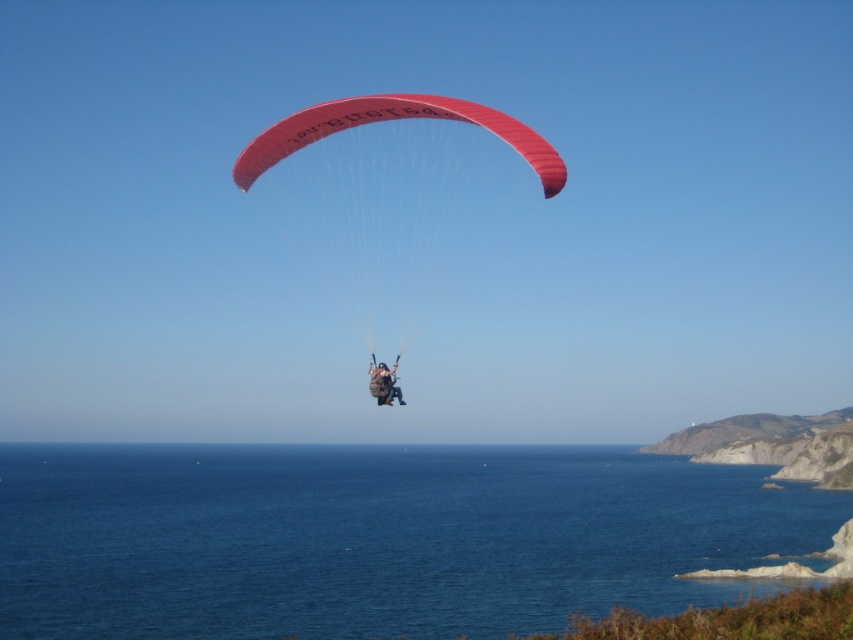
Can you confirm if blue liquid water at center is positioned below matte red parachute at center?

Indeed, blue liquid water at center is positioned under matte red parachute at center.

Which is behind, point (331, 552) or point (407, 141)?

Positioned behind is point (407, 141).

Is point (666, 524) positioned in front of point (343, 260)?

Yes.

This screenshot has width=853, height=640. What are the coordinates of `blue liquid water at center` in the screenshot? It's located at (378, 538).

Can you confirm if matte red parachute at center is smaller than camouflage fabric paraglider at center?

No, matte red parachute at center is not smaller than camouflage fabric paraglider at center.

Is matte red parachute at center below camouflage fabric paraglider at center?

No.

Is point (401, 301) behind point (378, 371)?

Yes.

The image size is (853, 640). What are the coordinates of `matte red parachute at center` in the screenshot? It's located at (397, 196).

Can you confirm if blue liquid water at center is wider than camouflage fabric paraglider at center?

Yes, blue liquid water at center is wider than camouflage fabric paraglider at center.

Can you confirm if blue liquid water at center is bigger than camouflage fabric paraglider at center?

Yes, blue liquid water at center is bigger than camouflage fabric paraglider at center.

Identify the location of blue liquid water at center. (378, 538).

The height and width of the screenshot is (640, 853). I want to click on blue liquid water at center, so click(x=378, y=538).